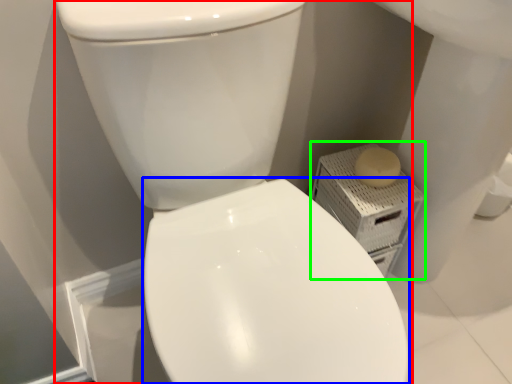
Question: Which is farther away from toilet (highlighted by a red box)? bidet (highlighted by a blue box) or porcelain (highlighted by a green box)?

Choices:
 (A) bidet
 (B) porcelain

Answer: (B)